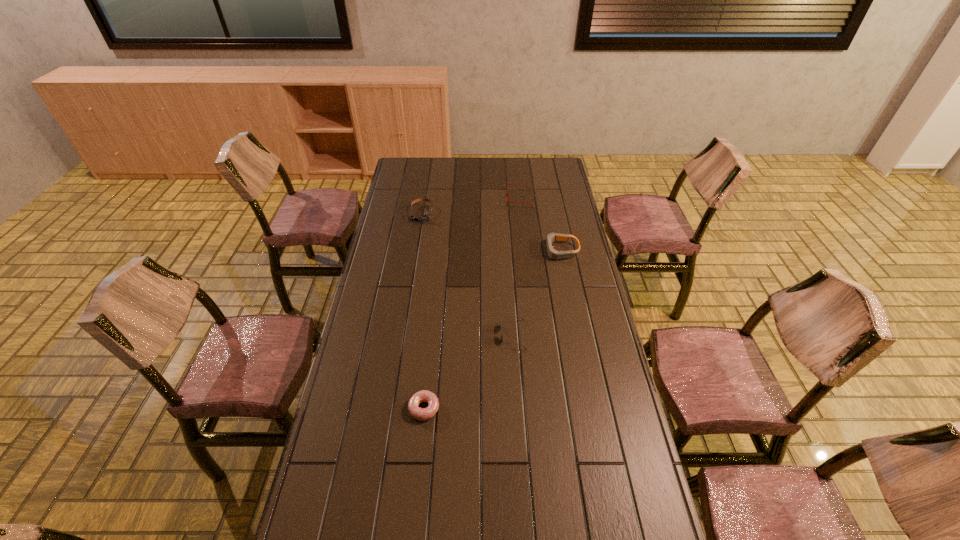
Locate an element on the screen. object present at the left edge is located at coordinates (426, 216).

Identify the location of object that is at the right edge. This screenshot has width=960, height=540. (552, 253).

Image resolution: width=960 pixels, height=540 pixels. I want to click on vacant position at the far edge of the desktop, so click(520, 168).

The height and width of the screenshot is (540, 960). In the image, there is a desktop. What are the coordinates of `vacant space at the left edge` in the screenshot? It's located at (354, 349).

In the image, there is a desktop. Find the location of `vacant space at the right edge`. vacant space at the right edge is located at coordinates (618, 456).

The image size is (960, 540). Find the location of `free space at the far right corner of the desktop`. free space at the far right corner of the desktop is located at coordinates (535, 178).

You are a GUI agent. You are given a task and a screenshot of the screen. Output one action in this format:
    pyautogui.click(x=<x>, y=<y>)
    Task: Click on the free space between the spectacles and the third nearest object
    This screenshot has width=960, height=540.
    Given the screenshot: What is the action you would take?
    pyautogui.click(x=516, y=267)

Locate an element on the screen. The height and width of the screenshot is (540, 960). free spot between the taller sunglasses and the second object from left to right is located at coordinates pos(468,372).

Where is `vacant region between the fifth farthest object and the taller sunglasses`? vacant region between the fifth farthest object and the taller sunglasses is located at coordinates (468, 372).

Find the location of `free space that is in between the nearer goggles and the doughnut`. free space that is in between the nearer goggles and the doughnut is located at coordinates (492, 329).